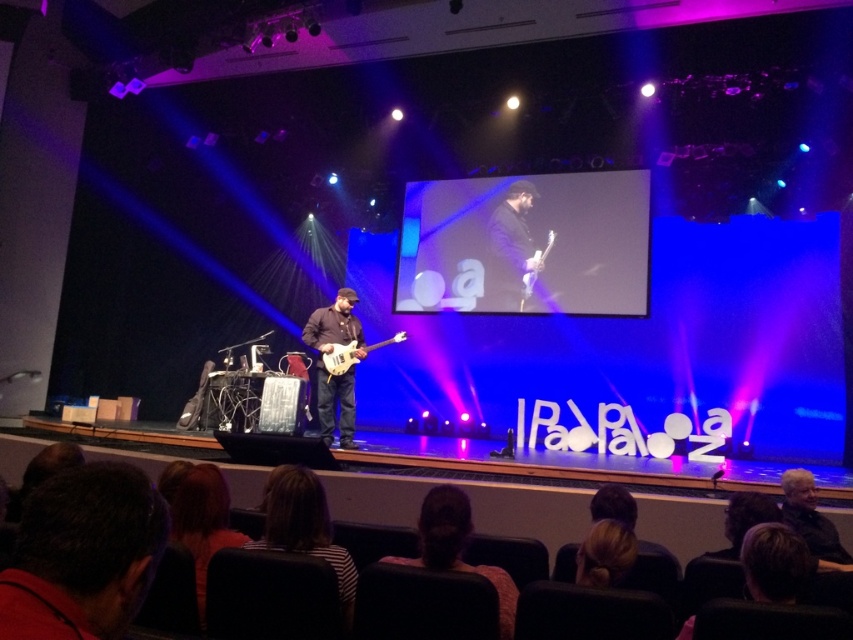
Question: Which of the following is the farthest from the observer?

Choices:
 (A) (347, 332)
 (B) (519, 252)
 (C) (332, 365)

Answer: (B)

Question: Is black matte guitar at center further to the viewer compared to glossy white electric guitar at upper center?

Choices:
 (A) yes
 (B) no

Answer: (A)

Question: Observing the image, what is the correct spatial positioning of black matte guitar at center in reference to glossy white electric guitar at upper center?

Choices:
 (A) left
 (B) right

Answer: (A)

Question: Is black matte guitar at center below shiny black guitar at center?

Choices:
 (A) yes
 (B) no

Answer: (B)

Question: Which point appears farthest from the camera in this image?

Choices:
 (A) (527, 288)
 (B) (357, 339)

Answer: (A)

Question: Which object is the farthest from the dark brown hair at lower center?

Choices:
 (A) shiny black guitar at center
 (B) shiny metallic electric guitar at center
 (C) glossy white electric guitar at upper center

Answer: (C)